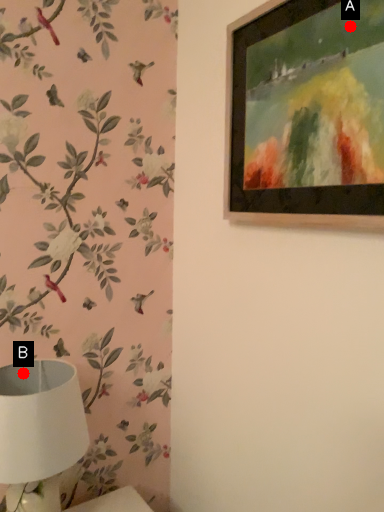
Question: Two points are circled on the image, labeled by A and B beside each circle. Which point appears farthest from the camera in this image?

Choices:
 (A) A is further
 (B) B is further

Answer: (B)